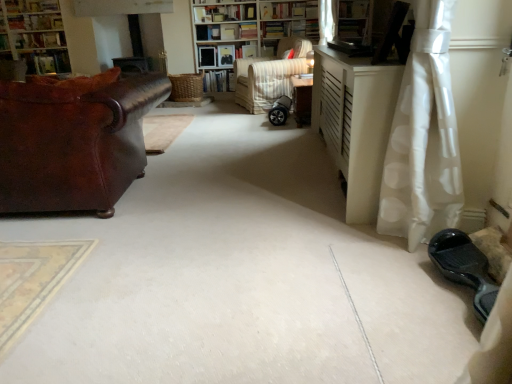
This screenshot has width=512, height=384. What do you see at coordinates (51, 62) in the screenshot?
I see `hardcover book at upper left, the 2th book when ordered from left to right` at bounding box center [51, 62].

Measure the distance between hardcover book at upper left, the 2th book when ordered from left to right, and camera.

hardcover book at upper left, the 2th book when ordered from left to right, is 5.56 meters away from camera.

Based on the photo, measure the distance between hardcover book at upper center, positioned as the second book in right-to-left order, and camera.

They are 21.34 feet apart.

Measure the distance between wooden bookshelf at upper left, which ranks as the 1th bookcase in left-to-right order, and camera.

wooden bookshelf at upper left, which ranks as the 1th bookcase in left-to-right order, and camera are 5.11 meters apart.

The height and width of the screenshot is (384, 512). Describe the element at coordinates (39, 40) in the screenshot. I see `hardcover book at upper left, the 6th book positioned from the right` at that location.

Identify the location of brown leather couch at left. The height and width of the screenshot is (384, 512). (74, 140).

In order to click on matte black table at center, acting as the 2th table starting from the front in this screenshot , I will do `click(302, 99)`.

The image size is (512, 384). Identify the location of hardcover book at upper left, arranged as the fifth book when viewed from the right. (51, 62).

How different are the orientations of hardcover book at upper center, placed as the 3th book when sorted from right to left, and white dotted fabric at right in degrees?

90.6 degrees.

From a real-world perspective, does hardcover book at upper center, which is counted as the 4th book, starting from the left, sit lower than white dotted fabric at right?

No, from a real-world perspective, hardcover book at upper center, which is counted as the 4th book, starting from the left, is not under white dotted fabric at right.

Consider the image. Is the depth of hardcover book at upper center, placed as the 3th book when sorted from right to left, less than that of white dotted fabric at right?

No, it is not.

At what (x,y) coordinates should I click in order to perform the action: click on shelf lying in front of the wooden bookshelf at center, which is the first shelf from left to right. Please return your answer as a coordinate pair (x, y). The image size is (512, 384). Looking at the image, I should click on (353, 27).

Consider the image. Is wooden bookshelf at upper center, the first shelf in the right-to-left sequence, oriented towards wooden bookshelf at center, arranged as the 1th shelf when viewed from the back?

No, wooden bookshelf at upper center, the first shelf in the right-to-left sequence, is not facing towards wooden bookshelf at center, arranged as the 1th shelf when viewed from the back.

Considering the relative sizes of wooden bookshelf at upper center, the 1th shelf from the front, and wooden bookshelf at center, placed as the 2th shelf when sorted from front to back, in the image provided, is wooden bookshelf at upper center, the 1th shelf from the front, taller than wooden bookshelf at center, placed as the 2th shelf when sorted from front to back,?

Yes, wooden bookshelf at upper center, the 1th shelf from the front, is taller than wooden bookshelf at center, placed as the 2th shelf when sorted from front to back.

Can we say wooden bookshelf at upper center, placed as the 2th shelf when sorted from left to right, lies outside wooden bookshelf at center, arranged as the 1th shelf when viewed from the back?

Yes, wooden bookshelf at upper center, placed as the 2th shelf when sorted from left to right, is located beyond the bounds of wooden bookshelf at center, arranged as the 1th shelf when viewed from the back.

From a real-world perspective, is hardcover book at upper center, which is counted as the 4th book, starting from the left, above or below hardcover book at upper center, positioned as the second book in right-to-left order?

In terms of real-world spatial position, hardcover book at upper center, which is counted as the 4th book, starting from the left, is above hardcover book at upper center, positioned as the second book in right-to-left order.

What's the angular difference between hardcover book at upper center, placed as the 3th book when sorted from right to left, and hardcover book at upper center, positioned as the second book in right-to-left order,'s facing directions?

hardcover book at upper center, placed as the 3th book when sorted from right to left, and hardcover book at upper center, positioned as the second book in right-to-left order, are facing 2.17 degrees away from each other.

Is hardcover book at upper center, which is counted as the 4th book, starting from the left, facing towards hardcover book at upper center, positioned as the second book in right-to-left order?

No, hardcover book at upper center, which is counted as the 4th book, starting from the left, is not turned towards hardcover book at upper center, positioned as the second book in right-to-left order.

Can you confirm if hardcover book at upper center, placed as the 3th book when sorted from right to left, is thinner than hardcover book at upper center, positioned as the second book in right-to-left order?

Indeed, hardcover book at upper center, placed as the 3th book when sorted from right to left, has a lesser width compared to hardcover book at upper center, positioned as the second book in right-to-left order.

From the image's perspective, which one is positioned higher, wooden bookshelf at upper left, which appears as the 2th bookcase when viewed from the right, or matte black table at center, acting as the 2th table starting from the front?

wooden bookshelf at upper left, which appears as the 2th bookcase when viewed from the right.

Visually, is wooden bookshelf at upper left, which ranks as the 1th bookcase in left-to-right order, positioned to the left or to the right of matte black table at center, acting as the 2th table starting from the front?

wooden bookshelf at upper left, which ranks as the 1th bookcase in left-to-right order, is to the left of matte black table at center, acting as the 2th table starting from the front.

Can you confirm if wooden bookshelf at upper left, which appears as the 2th bookcase when viewed from the right, is thinner than matte black table at center, the first table in the back-to-front sequence?

No, wooden bookshelf at upper left, which appears as the 2th bookcase when viewed from the right, is not thinner than matte black table at center, the first table in the back-to-front sequence.

Can you confirm if wooden bookshelf at upper left, which appears as the 2th bookcase when viewed from the right, is bigger than matte black table at center, acting as the 2th table starting from the front?

Indeed, wooden bookshelf at upper left, which appears as the 2th bookcase when viewed from the right, has a larger size compared to matte black table at center, acting as the 2th table starting from the front.

From the image's perspective, is striped fabric armchair at center over white textured bookcase at center, which is the first bookcase in right-to-left order?

No, from the image's perspective, striped fabric armchair at center is not above white textured bookcase at center, which is the first bookcase in right-to-left order.

Between point (250, 92) and point (297, 21), which one is positioned behind?

The point (297, 21) is more distant.

Does striped fabric armchair at center come in front of white textured bookcase at center, which is the first bookcase in right-to-left order?

Yes, it is.

Is striped fabric armchair at center bigger or smaller than white textured bookcase at center, which is the first bookcase in right-to-left order?

Clearly, striped fabric armchair at center is smaller in size than white textured bookcase at center, which is the first bookcase in right-to-left order.

Which object is further away from the camera, matte black table at center, acting as the 2th table starting from the front, or hardcover book at upper center, positioned as the second book in right-to-left order?

hardcover book at upper center, positioned as the second book in right-to-left order, is further from the camera.

From a real-world perspective, does matte black table at center, acting as the 2th table starting from the front, sit lower than hardcover book at upper center, the 5th book in the left-to-right sequence?

Yes, from a real-world perspective, matte black table at center, acting as the 2th table starting from the front, is beneath hardcover book at upper center, the 5th book in the left-to-right sequence.

From the picture: Which is farther, (300,80) or (239,33)?

The point (239,33) is behind.

How much distance is there between matte black table at center, the first table in the back-to-front sequence, and hardcover book at upper center, positioned as the second book in right-to-left order?

2.60 meters.

Is wooden bookshelf at center, which is the first shelf from left to right, oriented towards hardcover books at center, which is the 4th book from right to left?

No, wooden bookshelf at center, which is the first shelf from left to right, is not facing towards hardcover books at center, which is the 4th book from right to left.

From a real-world perspective, is wooden bookshelf at center, acting as the second shelf starting from the right, above or below hardcover books at center, which is the 3th book in left-to-right order?

wooden bookshelf at center, acting as the second shelf starting from the right, is situated higher than hardcover books at center, which is the 3th book in left-to-right order, in the real world.

From the picture: Is wooden bookshelf at center, arranged as the 1th shelf when viewed from the back, further to the viewer compared to hardcover books at center, which is the 3th book in left-to-right order?

No, wooden bookshelf at center, arranged as the 1th shelf when viewed from the back, is in front of hardcover books at center, which is the 3th book in left-to-right order.

Consider the image. How many degrees apart are the facing directions of wooden bookshelf at center, which is the first shelf from left to right, and hardcover books at center, which is the 3th book in left-to-right order?

The facing directions of wooden bookshelf at center, which is the first shelf from left to right, and hardcover books at center, which is the 3th book in left-to-right order, are 5.77 degrees apart.

From a real-world perspective, count 5th books upward from the white dotted fabric at right and point to it. Please provide its 2D coordinates.

[(224, 13)]

At what (x,y) coordinates should I click in order to perform the action: click on shelf below the wooden bookshelf at upper center, the 1th shelf when ordered from bottom to top (from a real-world perspective). Please return your answer as a coordinate pair (x, y). This screenshot has width=512, height=384. Looking at the image, I should click on (223, 54).

Looking at the image, which one is located closer to striped fabric armchair at center, hardcover book at upper left, the 6th book positioned from the right, or white matte cabinet at right, arranged as the 1th table when viewed from the front?

The object closer to striped fabric armchair at center is white matte cabinet at right, arranged as the 1th table when viewed from the front.

Based on their spatial positions, is hardcover book at upper left, the 6th book positioned from the right, or hardcover book at upper left, the 2th book when ordered from left to right, closer to wooden bookshelf at upper center, which appears as the 2th shelf when viewed from the back?

hardcover book at upper left, the 6th book positioned from the right, is positioned closer to the anchor wooden bookshelf at upper center, which appears as the 2th shelf when viewed from the back.

Looking at the image, which one is located further to brown leather couch at left, white matte cabinet at right, arranged as the 2th table when viewed from the back, or striped fabric armchair at center?

striped fabric armchair at center is positioned further to the anchor brown leather couch at left.

Which object lies nearer to the anchor point hardcover book at upper center, the 5th book in the left-to-right sequence, white matte cabinet at right, arranged as the 2th table when viewed from the back, or wooden bookshelf at upper center, which is counted as the 2th shelf, starting from the top?

Among the two, wooden bookshelf at upper center, which is counted as the 2th shelf, starting from the top, is located nearer to hardcover book at upper center, the 5th book in the left-to-right sequence.

Based on their spatial positions, is hardcover book at upper left, the 2th book when ordered from left to right, or white matte cabinet at right, arranged as the 1th table when viewed from the front, closer to brown leather couch at left?

Based on the image, white matte cabinet at right, arranged as the 1th table when viewed from the front, appears to be nearer to brown leather couch at left.

Considering their positions, is hardcover books at center, which is the 4th book from right to left, positioned closer to wooden bookshelf at upper left, which ranks as the 1th bookcase in left-to-right order, than wooden bookshelf at center, the 1th shelf when ordered from top to bottom?

wooden bookshelf at center, the 1th shelf when ordered from top to bottom, is positioned closer to the anchor wooden bookshelf at upper left, which ranks as the 1th bookcase in left-to-right order.

From the image, which object appears to be nearer to white textured bookcase at center, which is the first bookcase in right-to-left order, matte black table at center, the first table in the back-to-front sequence, or hardcover book at upper center, positioned as the second book in right-to-left order?

Among the two, hardcover book at upper center, positioned as the second book in right-to-left order, is located nearer to white textured bookcase at center, which is the first bookcase in right-to-left order.

Looking at the image, which one is located closer to brown leather couch at left, white textured bookcase at center, which is the first bookcase in right-to-left order, or wooden bookshelf at center, the 1th shelf when ordered from top to bottom?

white textured bookcase at center, which is the first bookcase in right-to-left order, lies closer to brown leather couch at left than the other object.

This screenshot has height=384, width=512. Identify the location of shelf located between wooden bookshelf at upper center, the first shelf in the right-to-left sequence, and hardcover book at upper left, arranged as the fifth book when viewed from the right, in the depth direction. (223, 54).

Image resolution: width=512 pixels, height=384 pixels. In order to click on bookcase between wooden bookshelf at upper left, which appears as the 2th bookcase when viewed from the right, and hardcover books at upper center, which appears as the sixth book when viewed from the left, in the horizontal direction in this screenshot , I will do `click(248, 23)`.

Where is `chair between matte black table at center, the first table in the back-to-front sequence, and wooden bookshelf at center, acting as the second shelf starting from the right, along the z-axis`? chair between matte black table at center, the first table in the back-to-front sequence, and wooden bookshelf at center, acting as the second shelf starting from the right, along the z-axis is located at coordinates (269, 76).

Where is `chair between brown leather couch at left and hardcover book at upper center, positioned as the second book in right-to-left order, along the z-axis`? chair between brown leather couch at left and hardcover book at upper center, positioned as the second book in right-to-left order, along the z-axis is located at coordinates (269, 76).